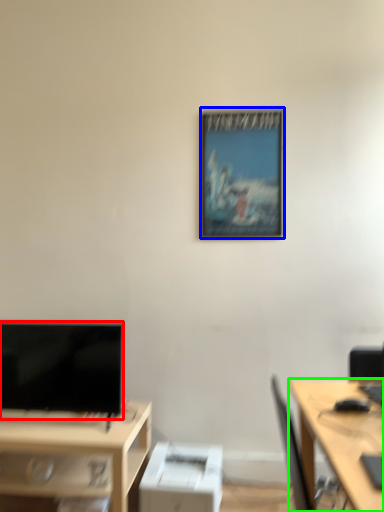
Question: Based on their relative distances, which object is farther from television (highlighted by a red box)? Choose from picture frame (highlighted by a blue box) and desk (highlighted by a green box).

Choices:
 (A) picture frame
 (B) desk

Answer: (B)